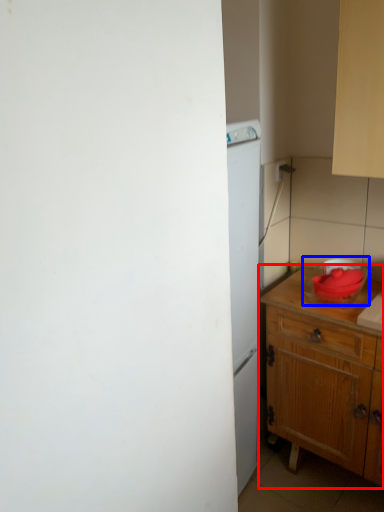
Question: Which of the following is the farthest to the observer, table (highlighted by a red box) or appliance (highlighted by a blue box)?

Choices:
 (A) table
 (B) appliance

Answer: (B)